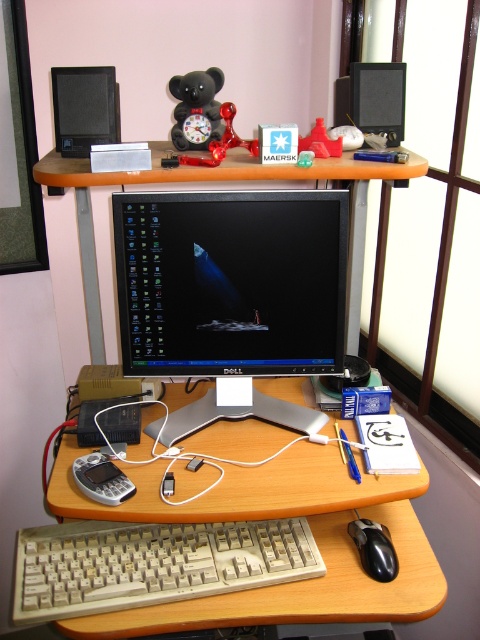
You are a photographer setting up a shot of the workspace. You want to focus on two points on the desk. The first point is at coordinates point [216,90], and the second is at point [235,109]. Which point should you adjust your focus to first if you want to capture both points clearly in the same frame?

You should focus on point [216,90] first because it is closer to the camera than point [235,109], ensuring both points are in focus when using depth of field.

You are organizing the desk and want to place a new item between the black glossy monitor at center and the glossy plastic bear at upper center. Is there enough vertical space between them for the item?

The black glossy monitor at center is located below the glossy plastic bear at upper center, so there is vertical space between them. You can place the new item between them.

You are organizing the desk items and want to place a new item between the black matte bear at upper center and the glossy plastic bear at upper center. Is this possible?

The glossy plastic bear at upper center is behind the black matte bear at upper center, so there is no space between them for placing a new item.